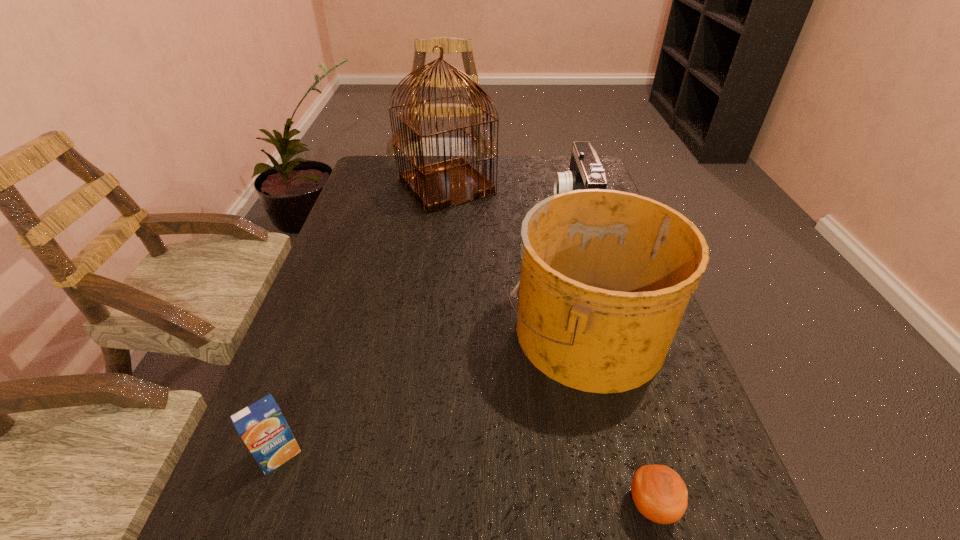
Identify the location of free spot between the leftmost object and the birdcage. (363, 321).

The image size is (960, 540). I want to click on free spot between the third tallest object and the birdcage, so click(510, 197).

Select which object is the second closest to the birdcage. Please provide its 2D coordinates. Your answer should be formatted as a tuple, i.e. [(x, y)], where the tuple contains the x and y coordinates of a point satisfying the conditions above.

[(606, 275)]

The height and width of the screenshot is (540, 960). In order to click on object that is the third closest to the bucket in this screenshot , I will do [x=445, y=184].

At what (x,y) coordinates should I click in order to perform the action: click on vacant space that satisfies the following two spatial constraints: 1. on the front side of the bucket; 2. on the right side of the second object from left to right. Please return your answer as a coordinate pair (x, y). Looking at the image, I should click on (430, 329).